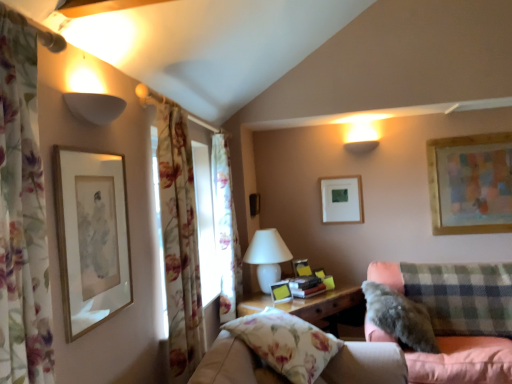
Question: From the image's perspective, is gold-framed artwork at upper left, positioned as the 4th picture frame in right-to-left order, located above green checkered pillow at right?

Choices:
 (A) no
 (B) yes

Answer: (B)

Question: Considering the relative sizes of gold-framed artwork at upper left, the 1th picture frame positioned from the front, and green checkered pillow at right in the image provided, is gold-framed artwork at upper left, the 1th picture frame positioned from the front, smaller than green checkered pillow at right?

Choices:
 (A) no
 (B) yes

Answer: (B)

Question: Is green checkered pillow at right surrounded by gold-framed artwork at upper left, the 1th picture frame positioned from the front?

Choices:
 (A) yes
 (B) no

Answer: (B)

Question: From the image's perspective, is gold-framed artwork at upper left, which is the 1th picture frame in left-to-right order, located beneath green checkered pillow at right?

Choices:
 (A) yes
 (B) no

Answer: (B)

Question: From a real-world perspective, is gold-framed artwork at upper left, positioned as the 4th picture frame in right-to-left order, physically below green checkered pillow at right?

Choices:
 (A) no
 (B) yes

Answer: (A)

Question: Is gold-framed artwork at upper left, which appears as the 4th picture frame when viewed from the back, turned away from green checkered pillow at right?

Choices:
 (A) yes
 (B) no

Answer: (B)

Question: Can you confirm if matte yellow picture frame at center, acting as the 2th picture frame starting from the left, is wider than floral fabric curtain at left, which is the 1th curtain in front-to-back order?

Choices:
 (A) no
 (B) yes

Answer: (A)

Question: Would you say floral fabric curtain at left, which is the 1th curtain in front-to-back order, is part of matte yellow picture frame at center, acting as the 2th picture frame starting from the left,'s contents?

Choices:
 (A) yes
 (B) no

Answer: (B)

Question: Would you consider matte yellow picture frame at center, the third picture frame in the back-to-front sequence, to be distant from floral fabric curtain at left, which is the 1th curtain in front-to-back order?

Choices:
 (A) no
 (B) yes

Answer: (B)

Question: Is matte yellow picture frame at center, acting as the 2th picture frame starting from the left, to the left of floral fabric curtain at left, the third curtain positioned from the back, from the viewer's perspective?

Choices:
 (A) yes
 (B) no

Answer: (B)

Question: Is matte yellow picture frame at center, the third picture frame in the back-to-front sequence, further to camera compared to floral fabric curtain at left, the third curtain positioned from the back?

Choices:
 (A) yes
 (B) no

Answer: (A)

Question: Does matte yellow picture frame at center, acting as the 2th picture frame starting from the left, have a greater height compared to floral fabric curtain at left, the third curtain positioned from the back?

Choices:
 (A) no
 (B) yes

Answer: (A)

Question: Can you confirm if white ceramic table lamp at center is smaller than floral fabric curtain at left, the third curtain positioned from the back?

Choices:
 (A) no
 (B) yes

Answer: (A)